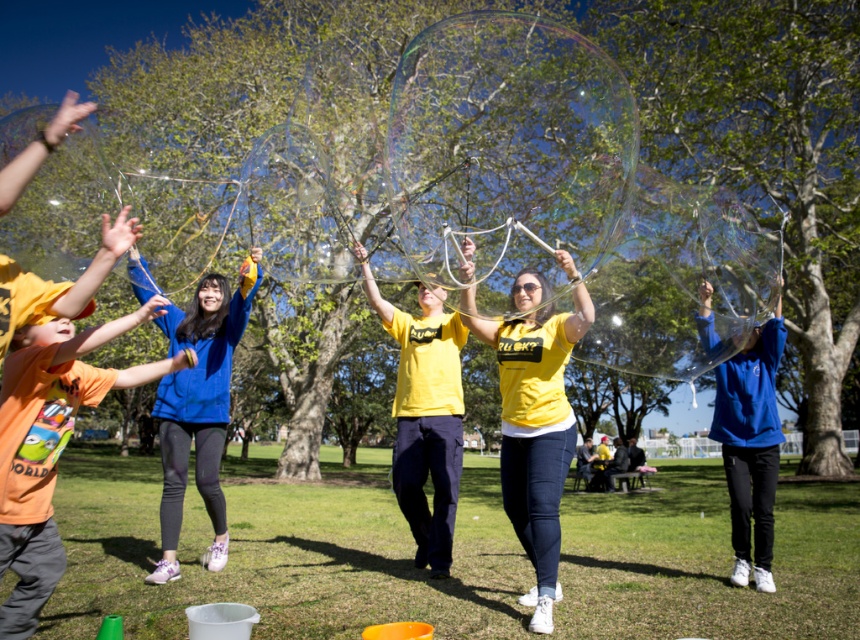
Question: Which object is the farthest from the matte orange t-shirt at left?

Choices:
 (A) blue fleece jacket at center
 (B) yellow matte shirt at center

Answer: (B)

Question: Which of the following is the closest to the observer?

Choices:
 (A) (164, 564)
 (B) (26, 353)

Answer: (B)

Question: Can you confirm if yellow matte shirt at center is thinner than blue fleece jacket at center?

Choices:
 (A) no
 (B) yes

Answer: (B)

Question: Can you confirm if matte orange t-shirt at left is smaller than blue fleece jacket at center?

Choices:
 (A) yes
 (B) no

Answer: (A)

Question: Which of these objects is positioned closest to the yellow matte shirt at center?

Choices:
 (A) blue fleece jacket at center
 (B) matte orange t-shirt at left

Answer: (B)

Question: From the image, what is the correct spatial relationship of yellow matte shirt at center in relation to blue fleece jacket at center?

Choices:
 (A) above
 (B) below

Answer: (A)